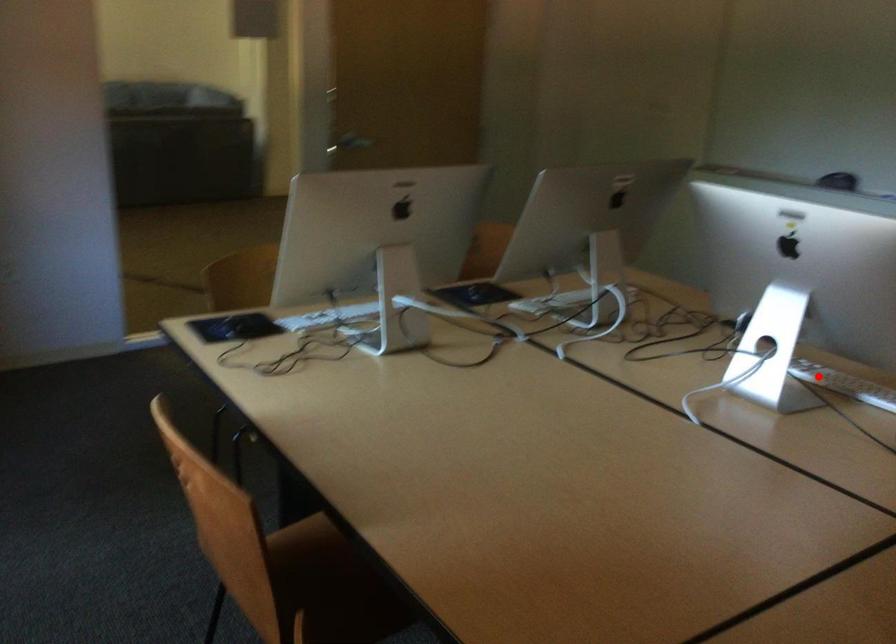
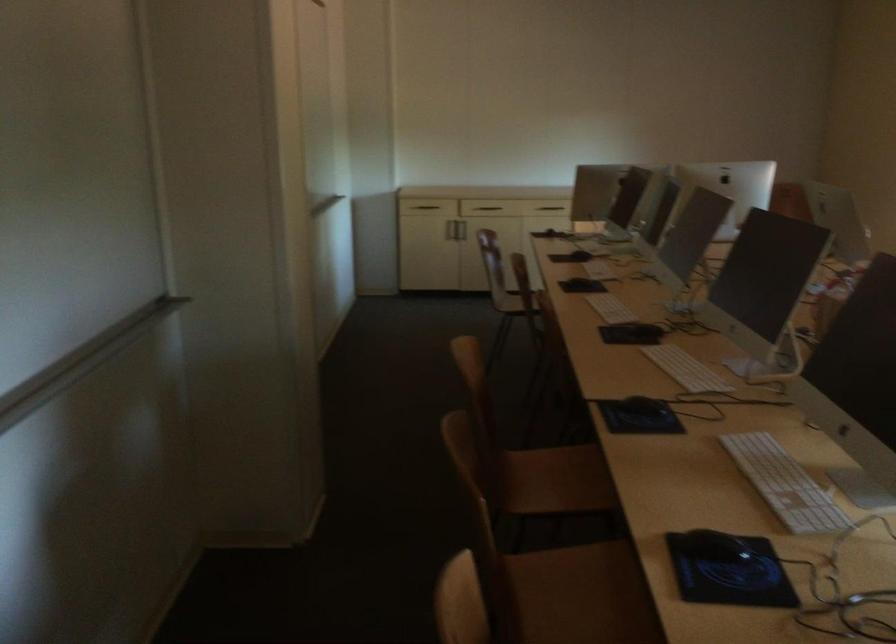
The point at the highlighted location is marked in the first image. Where is the corresponding point in the second image?

(784, 484)